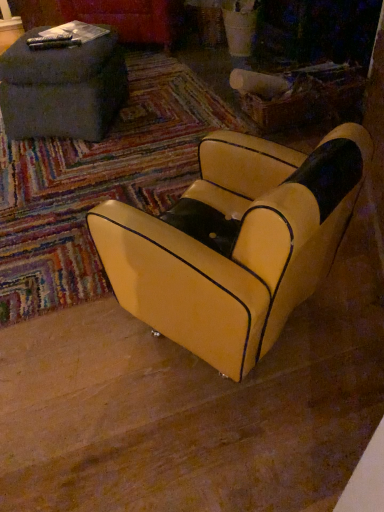
Question: Is yellow leather chair at center bigger or smaller than dark gray fabric ottoman at upper left?

Choices:
 (A) small
 (B) big

Answer: (B)

Question: From a real-world perspective, is yellow leather chair at center physically located above or below dark gray fabric ottoman at upper left?

Choices:
 (A) above
 (B) below

Answer: (A)

Question: Is point (291, 292) closer or farther from the camera than point (52, 65)?

Choices:
 (A) farther
 (B) closer

Answer: (B)

Question: From a real-world perspective, is dark gray fabric ottoman at upper left physically located above or below yellow leather chair at center?

Choices:
 (A) below
 (B) above

Answer: (A)

Question: Is dark gray fabric ottoman at upper left spatially inside yellow leather chair at center, or outside of it?

Choices:
 (A) inside
 (B) outside

Answer: (B)

Question: Considering the positions of dark gray fabric ottoman at upper left and yellow leather chair at center in the image, is dark gray fabric ottoman at upper left bigger or smaller than yellow leather chair at center?

Choices:
 (A) big
 (B) small

Answer: (B)

Question: In the image, is dark gray fabric ottoman at upper left positioned in front of or behind yellow leather chair at center?

Choices:
 (A) front
 (B) behind

Answer: (B)